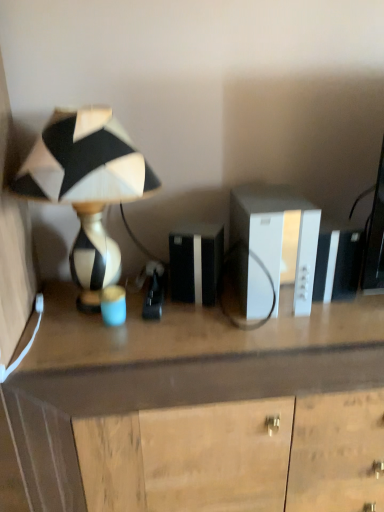
Question: From a real-world perspective, is black and white ceramic lamp at left positioned above or below white plastic cabinet at center?

Choices:
 (A) above
 (B) below

Answer: (A)

Question: In the image, is black and white ceramic lamp at left positioned in front of or behind white plastic cabinet at center?

Choices:
 (A) behind
 (B) front

Answer: (B)

Question: Which object is the farthest from the black and white ceramic lamp at left?

Choices:
 (A) wooden desk at center
 (B) white plastic cabinet at center

Answer: (B)

Question: Which object is positioned farthest from the white plastic cabinet at center?

Choices:
 (A) black and white ceramic lamp at left
 (B) wooden desk at center

Answer: (A)